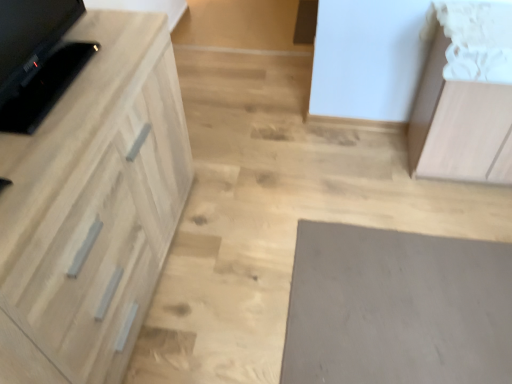
At what (x,y) coordinates should I click in order to perform the action: click on light wood cabinet at left, acting as the 2th cabinetry starting from the right. Please return your answer as a coordinate pair (x, y). This screenshot has width=512, height=384. Looking at the image, I should click on (92, 207).

The height and width of the screenshot is (384, 512). What do you see at coordinates (36, 59) in the screenshot?
I see `black glossy tv at left` at bounding box center [36, 59].

You are a GUI agent. You are given a task and a screenshot of the screen. Output one action in this format:
    pyautogui.click(x=<x>, y=<y>)
    Task: Click on the light wood cabinet at left, the 1th cabinetry when ordered from left to right
    This screenshot has height=384, width=512.
    Given the screenshot: What is the action you would take?
    pyautogui.click(x=92, y=207)

Between black glossy tv at left and light wood cabinet at left, acting as the 2th cabinetry starting from the right, which one is positioned behind?

black glossy tv at left is more distant.

From the image's perspective, is black glossy tv at left on light wood cabinet at left, acting as the 2th cabinetry starting from the right?

Correct, black glossy tv at left appears higher than light wood cabinet at left, acting as the 2th cabinetry starting from the right, in the image.

Between black glossy tv at left and light wood cabinet at left, the 1th cabinetry when ordered from left to right, which one has smaller width?

black glossy tv at left is thinner.

Is point (19, 3) more distant than point (55, 137)?

Yes, it is.

Would you say black glossy tv at left is part of light brown wood cabinet at upper right, the 1th cabinetry when ordered from right to left,'s contents?

That's incorrect, black glossy tv at left is not inside light brown wood cabinet at upper right, the 1th cabinetry when ordered from right to left.

From the image's perspective, which cabinetry is the 1st one below the black glossy tv at left? Please provide its 2D coordinates.

[(466, 97)]

Which of these two, light brown wood cabinet at upper right, the 1th cabinetry when ordered from right to left, or black glossy tv at left, stands shorter?

black glossy tv at left.

From the image's perspective, is light brown wood cabinet at upper right, the 2th cabinetry viewed from the left, under black glossy tv at left?

Correct, light brown wood cabinet at upper right, the 2th cabinetry viewed from the left, appears lower than black glossy tv at left in the image.

Can you see gray matte mat at lower right touching light wood cabinet at left, acting as the 2th cabinetry starting from the right?

gray matte mat at lower right is not next to light wood cabinet at left, acting as the 2th cabinetry starting from the right, and they're not touching.

Which object is further away from the camera taking this photo, gray matte mat at lower right or light wood cabinet at left, the 1th cabinetry when ordered from left to right?

gray matte mat at lower right is more distant.

What's the angular difference between gray matte mat at lower right and light wood cabinet at left, acting as the 2th cabinetry starting from the right,'s facing directions?

88.8 degrees.

From a real-world perspective, which object rests below the other?

gray matte mat at lower right.

Could you tell me if light wood cabinet at left, acting as the 2th cabinetry starting from the right, is facing gray matte mat at lower right?

Yes, light wood cabinet at left, acting as the 2th cabinetry starting from the right, is oriented towards gray matte mat at lower right.

From a real-world perspective, who is located higher, light wood cabinet at left, the 1th cabinetry when ordered from left to right, or gray matte mat at lower right?

From a 3D spatial view, light wood cabinet at left, the 1th cabinetry when ordered from left to right, is above.

From a real-world perspective, which cabinetry is the 2nd one above the gray matte mat at lower right? Please provide its 2D coordinates.

[(92, 207)]

Considering the sizes of objects light wood cabinet at left, the 1th cabinetry when ordered from left to right, and black glossy tv at left in the image provided, who is taller, light wood cabinet at left, the 1th cabinetry when ordered from left to right, or black glossy tv at left?

light wood cabinet at left, the 1th cabinetry when ordered from left to right, is taller.

How much distance is there between light wood cabinet at left, the 1th cabinetry when ordered from left to right, and black glossy tv at left?

light wood cabinet at left, the 1th cabinetry when ordered from left to right, and black glossy tv at left are 9.05 inches apart from each other.

Which point is more distant from viewer, (164, 96) or (11, 44)?

Point (164, 96)

Considering the relative sizes of gray matte mat at lower right and light brown wood cabinet at upper right, the 2th cabinetry viewed from the left, in the image provided, is gray matte mat at lower right thinner than light brown wood cabinet at upper right, the 2th cabinetry viewed from the left,?

No.

Looking at this image, considering the sizes of objects gray matte mat at lower right and light brown wood cabinet at upper right, the 1th cabinetry when ordered from right to left, in the image provided, who is shorter, gray matte mat at lower right or light brown wood cabinet at upper right, the 1th cabinetry when ordered from right to left,?

gray matte mat at lower right.

Does point (333, 273) appear closer or farther from the camera than point (409, 138)?

Point (333, 273) is positioned closer to the camera compared to point (409, 138).

Which of these two, gray matte mat at lower right or black glossy tv at left, is thinner?

black glossy tv at left is thinner.

At what (x,y) coordinates should I click in order to perform the action: click on mat below the black glossy tv at left (from a real-world perspective). Please return your answer as a coordinate pair (x, y). This screenshot has width=512, height=384. Looking at the image, I should click on (397, 308).

From the image's perspective, which one is positioned lower, gray matte mat at lower right or black glossy tv at left?

From the image's view, gray matte mat at lower right is below.

Considering the positions of point (509, 339) and point (35, 26), is point (509, 339) closer or farther from the camera than point (35, 26)?

Point (509, 339) is farther from the camera than point (35, 26).

Identify the location of appliance on the left of light wood cabinet at left, acting as the 2th cabinetry starting from the right. (36, 59).

The image size is (512, 384). Find the location of `the 1st cabinetry below the black glossy tv at left (from the image's perspective)`. the 1st cabinetry below the black glossy tv at left (from the image's perspective) is located at coordinates (466, 97).

When comparing their distances from black glossy tv at left, does light wood cabinet at left, acting as the 2th cabinetry starting from the right, or gray matte mat at lower right seem further?

The object further to black glossy tv at left is gray matte mat at lower right.

When comparing their distances from black glossy tv at left, does light brown wood cabinet at upper right, the 2th cabinetry viewed from the left, or gray matte mat at lower right seem further?

light brown wood cabinet at upper right, the 2th cabinetry viewed from the left, is positioned further to the anchor black glossy tv at left.

Estimate the real-world distances between objects in this image. Which object is closer to gray matte mat at lower right, light brown wood cabinet at upper right, the 1th cabinetry when ordered from right to left, or black glossy tv at left?

Based on the image, light brown wood cabinet at upper right, the 1th cabinetry when ordered from right to left, appears to be nearer to gray matte mat at lower right.

Estimate the real-world distances between objects in this image. Which object is closer to black glossy tv at left, light brown wood cabinet at upper right, the 1th cabinetry when ordered from right to left, or light wood cabinet at left, acting as the 2th cabinetry starting from the right?

Among the two, light wood cabinet at left, acting as the 2th cabinetry starting from the right, is located nearer to black glossy tv at left.

Estimate the real-world distances between objects in this image. Which object is closer to light brown wood cabinet at upper right, the 2th cabinetry viewed from the left, gray matte mat at lower right or light wood cabinet at left, acting as the 2th cabinetry starting from the right?

gray matte mat at lower right.

Estimate the real-world distances between objects in this image. Which object is closer to light brown wood cabinet at upper right, the 1th cabinetry when ordered from right to left, black glossy tv at left or gray matte mat at lower right?

gray matte mat at lower right lies closer to light brown wood cabinet at upper right, the 1th cabinetry when ordered from right to left, than the other object.

Estimate the real-world distances between objects in this image. Which object is closer to light wood cabinet at left, acting as the 2th cabinetry starting from the right, gray matte mat at lower right or black glossy tv at left?

black glossy tv at left is positioned closer to the anchor light wood cabinet at left, acting as the 2th cabinetry starting from the right.

Consider the image. When comparing their distances from gray matte mat at lower right, does light wood cabinet at left, acting as the 2th cabinetry starting from the right, or black glossy tv at left seem closer?

light wood cabinet at left, acting as the 2th cabinetry starting from the right, is closer to gray matte mat at lower right.

The width and height of the screenshot is (512, 384). Identify the location of cabinetry between black glossy tv at left and gray matte mat at lower right from left to right. (92, 207).

Where is `mat between light wood cabinet at left, the 1th cabinetry when ordered from left to right, and light brown wood cabinet at upper right, the 2th cabinetry viewed from the left`? The image size is (512, 384). mat between light wood cabinet at left, the 1th cabinetry when ordered from left to right, and light brown wood cabinet at upper right, the 2th cabinetry viewed from the left is located at coordinates (397, 308).

The image size is (512, 384). What are the coordinates of `mat between black glossy tv at left and light brown wood cabinet at upper right, the 2th cabinetry viewed from the left, from left to right` in the screenshot? It's located at (397, 308).

Locate an element on the screen. The height and width of the screenshot is (384, 512). cabinetry between black glossy tv at left and light brown wood cabinet at upper right, the 1th cabinetry when ordered from right to left is located at coordinates (92, 207).